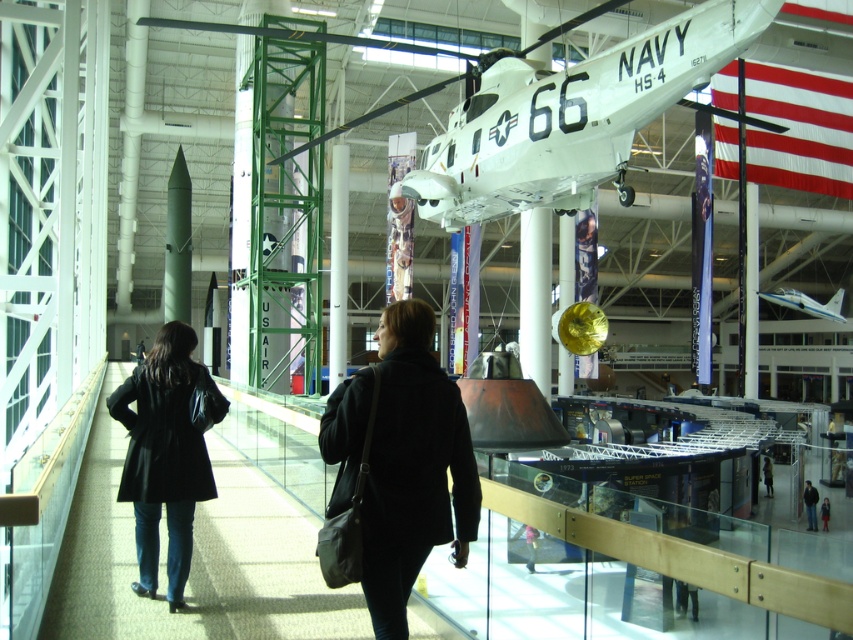
Question: Is the position of light blue plastic airplane at center more distant than that of dark blue jacket at lower right?

Choices:
 (A) no
 (B) yes

Answer: (B)

Question: Is black leather coat at lower left closer to camera compared to dark blue coat at center?

Choices:
 (A) yes
 (B) no

Answer: (A)

Question: Estimate the real-world distances between objects in this image. Which object is farther from the black fabric coat at center?

Choices:
 (A) dark blue coat at center
 (B) black leather coat at lower left
 (C) dark blue coat at lower right

Answer: (A)

Question: Which is nearer to the dark blue jacket at lower right?

Choices:
 (A) light blue plastic airplane at center
 (B) dark blue coat at center
 (C) dark blue coat at lower right
 (D) black leather coat at lower left

Answer: (C)

Question: Does light blue plastic airplane at center appear under dark blue jacket at lower right?

Choices:
 (A) yes
 (B) no

Answer: (B)

Question: Which point appears farthest from the camera in this image?

Choices:
 (A) 811,484
 (B) 824,508
 (C) 767,492
 (D) 824,308

Answer: (C)